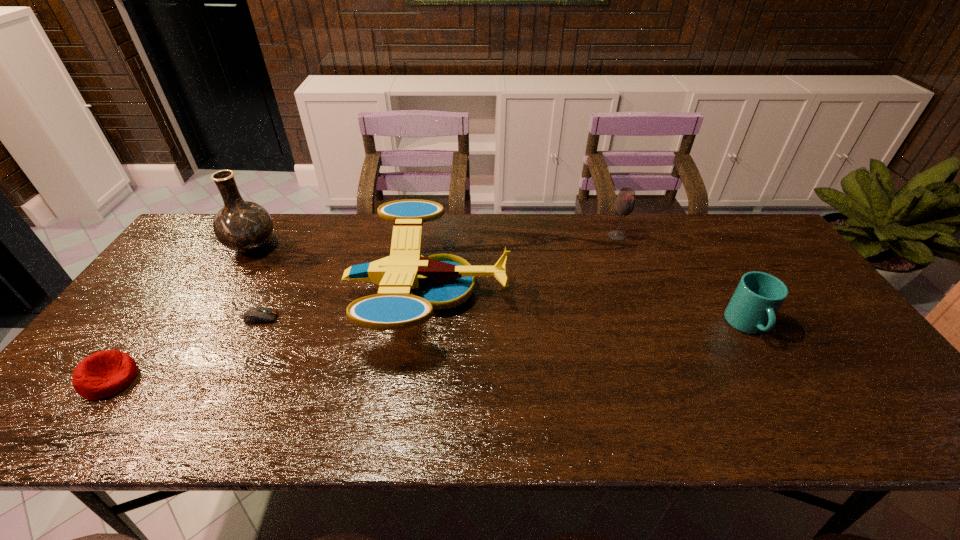
What are the coordinates of `vase` in the screenshot? It's located at (242, 226).

Find the location of a particular element. the fifth object from right to left is located at coordinates (242, 226).

Find the location of a particular element. This screenshot has height=540, width=960. the second object from right to left is located at coordinates (624, 204).

At what (x,y) coordinates should I click in order to perform the action: click on the fourth object from left to right. Please return your answer as a coordinate pair (x, y). Image resolution: width=960 pixels, height=540 pixels. Looking at the image, I should click on (410, 286).

In order to click on the rightmost object in this screenshot , I will do `click(752, 309)`.

Find the location of a particular element. the fifth tallest object is located at coordinates (103, 374).

At what (x,y) coordinates should I click in order to perform the action: click on beanbag. Please return your answer as a coordinate pair (x, y). Image resolution: width=960 pixels, height=540 pixels. Looking at the image, I should click on (103, 374).

The width and height of the screenshot is (960, 540). I want to click on the shortest object, so click(x=255, y=315).

Where is `computer equipment`? This screenshot has width=960, height=540. computer equipment is located at coordinates (255, 315).

Identify the location of vacant area located 0.250m on the front of the fifth object from right to left. The height and width of the screenshot is (540, 960). (x=204, y=326).